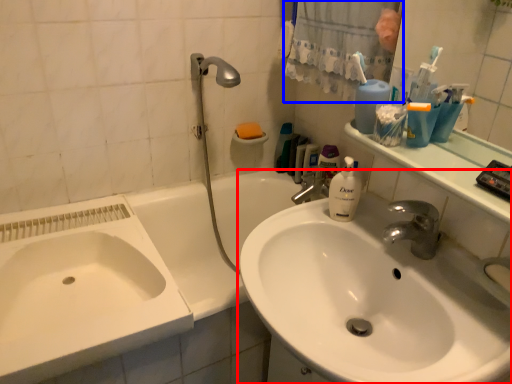
Question: Which object is closer to the camera taking this photo, sink (highlighted by a red box) or shower curtain (highlighted by a blue box)?

Choices:
 (A) sink
 (B) shower curtain

Answer: (A)